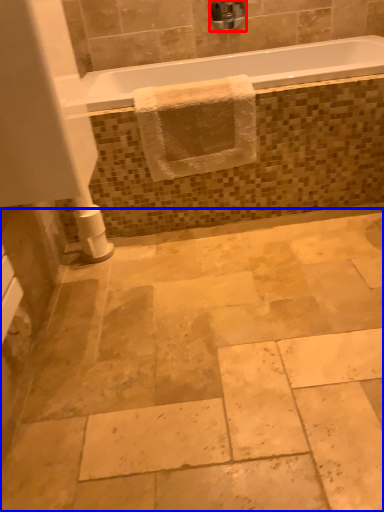
Question: Which object appears farthest to the camera in this image, faucet (highlighted by a red box) or ceramic tile (highlighted by a blue box)?

Choices:
 (A) faucet
 (B) ceramic tile

Answer: (A)